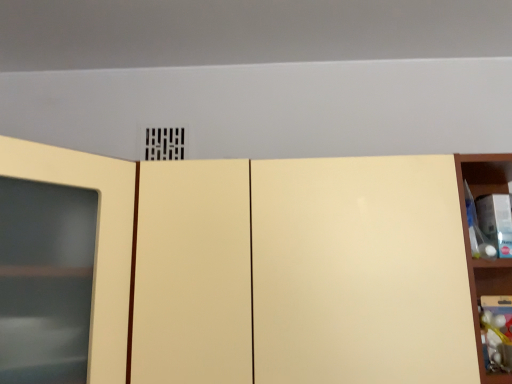
Question: Can you confirm if matte yellow cabinet at center is smaller than matte wood shelf at right?

Choices:
 (A) no
 (B) yes

Answer: (A)

Question: Does matte yellow cabinet at center lie in front of matte wood shelf at right?

Choices:
 (A) yes
 (B) no

Answer: (A)

Question: Can you confirm if matte yellow cabinet at center is bigger than matte wood shelf at right?

Choices:
 (A) no
 (B) yes

Answer: (B)

Question: Is matte yellow cabinet at center far from matte wood shelf at right?

Choices:
 (A) yes
 (B) no

Answer: (B)

Question: Is matte yellow cabinet at center at the right side of matte wood shelf at right?

Choices:
 (A) yes
 (B) no

Answer: (B)

Question: Does matte yellow cabinet at center have a greater height compared to matte wood shelf at right?

Choices:
 (A) yes
 (B) no

Answer: (B)

Question: From the image's perspective, is matte wood shelf at right on matte yellow cabinet at center?

Choices:
 (A) yes
 (B) no

Answer: (B)

Question: Is matte yellow cabinet at center a part of matte wood shelf at right?

Choices:
 (A) no
 (B) yes

Answer: (A)

Question: Is there a large distance between matte wood shelf at right and matte yellow cabinet at center?

Choices:
 (A) yes
 (B) no

Answer: (B)

Question: Would you say matte wood shelf at right is outside matte yellow cabinet at center?

Choices:
 (A) yes
 (B) no

Answer: (A)

Question: Is the depth of matte wood shelf at right greater than that of matte yellow cabinet at center?

Choices:
 (A) no
 (B) yes

Answer: (B)

Question: Is matte wood shelf at right touching matte yellow cabinet at center?

Choices:
 (A) yes
 (B) no

Answer: (B)

Question: Considering the positions of point (488, 160) and point (309, 352), is point (488, 160) closer or farther from the camera than point (309, 352)?

Choices:
 (A) farther
 (B) closer

Answer: (A)